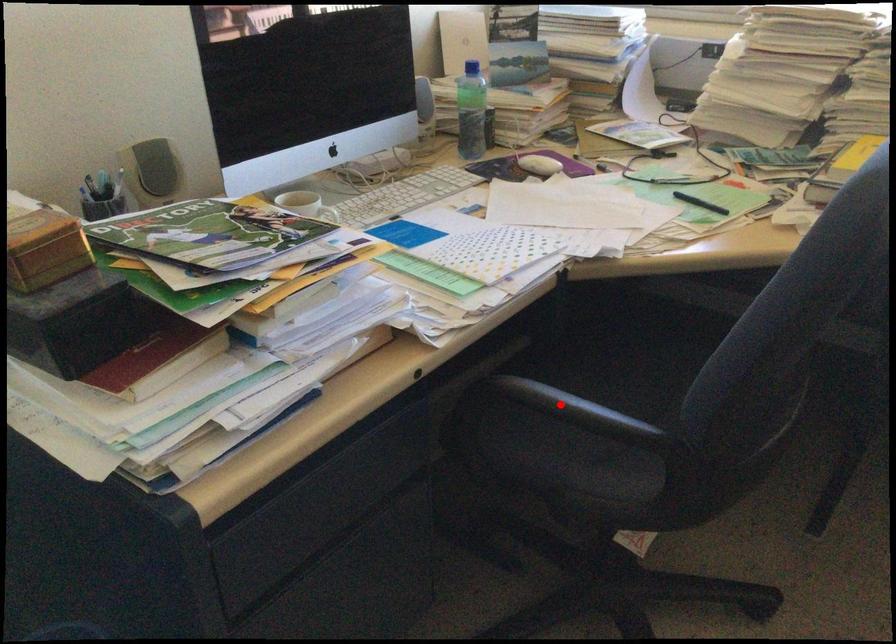
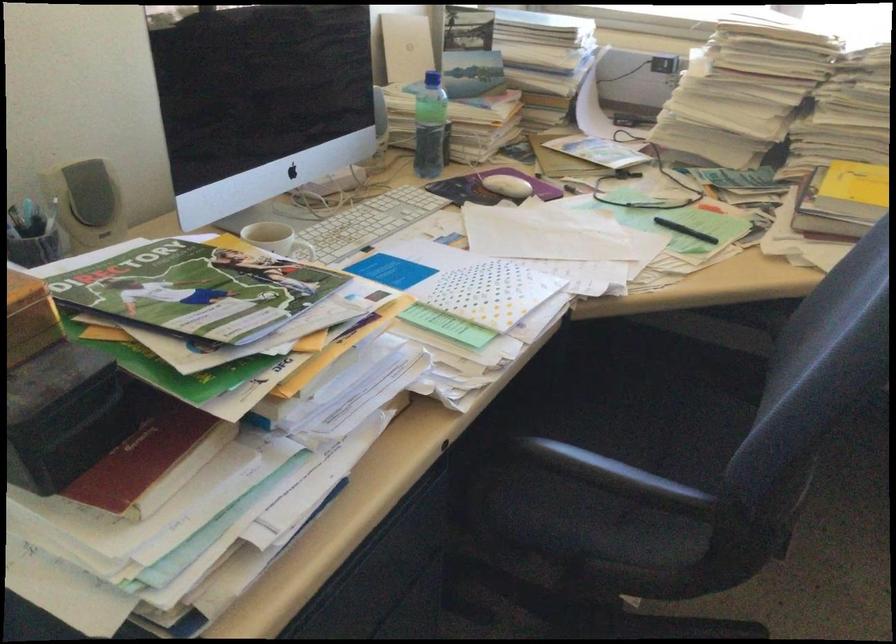
Question: I am providing you with two images of the same scene from different viewpoints. A red point is shown in image1. For the corresponding object point in image2, is it positioned nearer or farther from the camera?

Choices:
 (A) Nearer
 (B) Farther

Answer: (A)